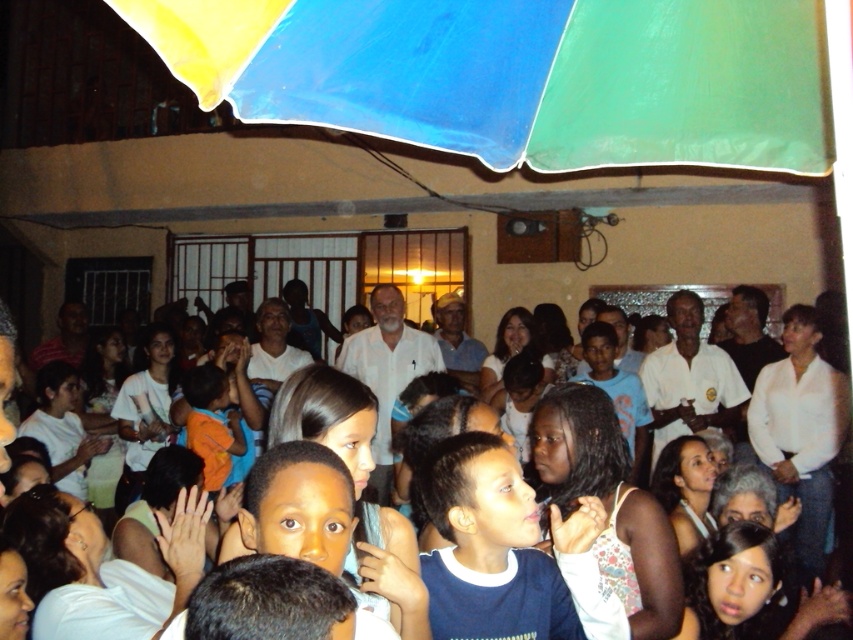
Is white cotton crowd at center to the left of orange cotton shirt at center from the viewer's perspective?

In fact, white cotton crowd at center is to the right of orange cotton shirt at center.

Is white cotton crowd at center positioned in front of orange cotton shirt at center?

No.

Where is `white cotton crowd at center`? The height and width of the screenshot is (640, 853). white cotton crowd at center is located at coordinates (552, 449).

Between point (460, 154) and point (245, 396), which one is positioned behind?

Positioned behind is point (245, 396).

Does polyester umbrella at upper center appear on the right side of orange cotton shirt at center?

Yes, polyester umbrella at upper center is to the right of orange cotton shirt at center.

Is point (364, 125) behind point (238, 378)?

That is False.

This screenshot has width=853, height=640. Find the location of `polyester umbrella at upper center`. polyester umbrella at upper center is located at coordinates (515, 76).

Between polyester umbrella at upper center and white cotton crowd at center, which one appears on the right side from the viewer's perspective?

Positioned to the right is white cotton crowd at center.

Who is positioned more to the left, polyester umbrella at upper center or white cotton crowd at center?

polyester umbrella at upper center is more to the left.

You are a GUI agent. You are given a task and a screenshot of the screen. Output one action in this format:
    pyautogui.click(x=<x>, y=<y>)
    Task: Click on the polyester umbrella at upper center
    The width and height of the screenshot is (853, 640).
    Given the screenshot: What is the action you would take?
    click(x=515, y=76)